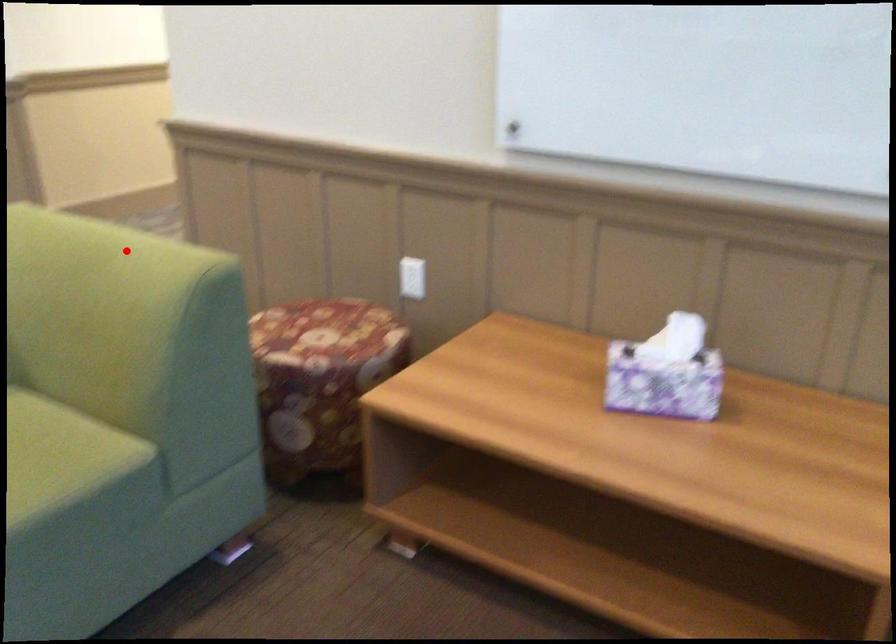
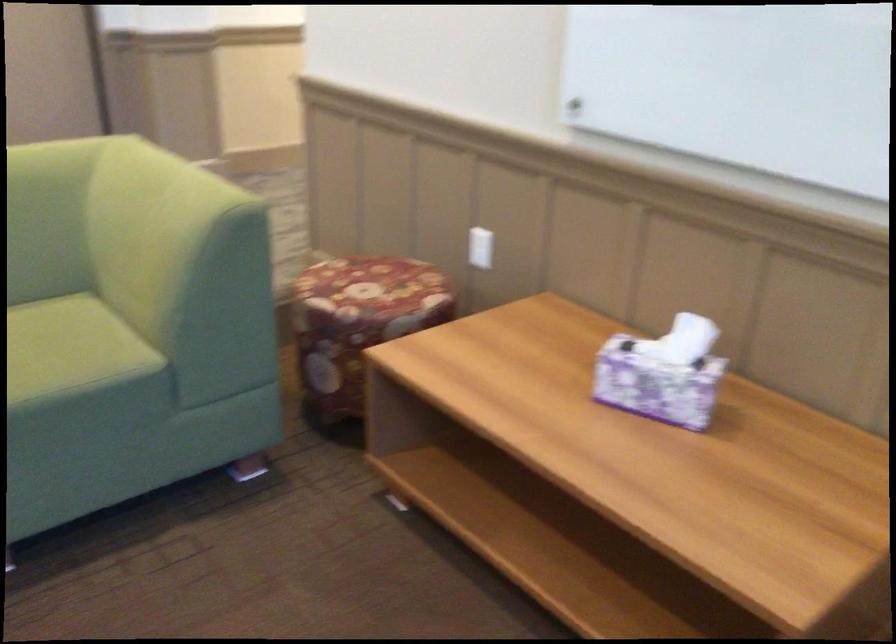
Find the pixel in the second image that matches the highlighted location in the first image.

(181, 184)